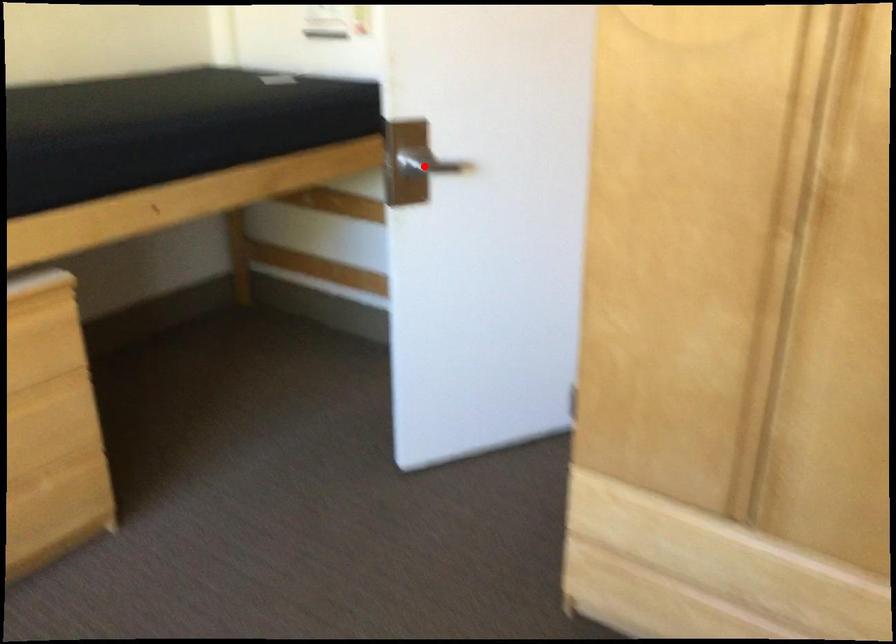
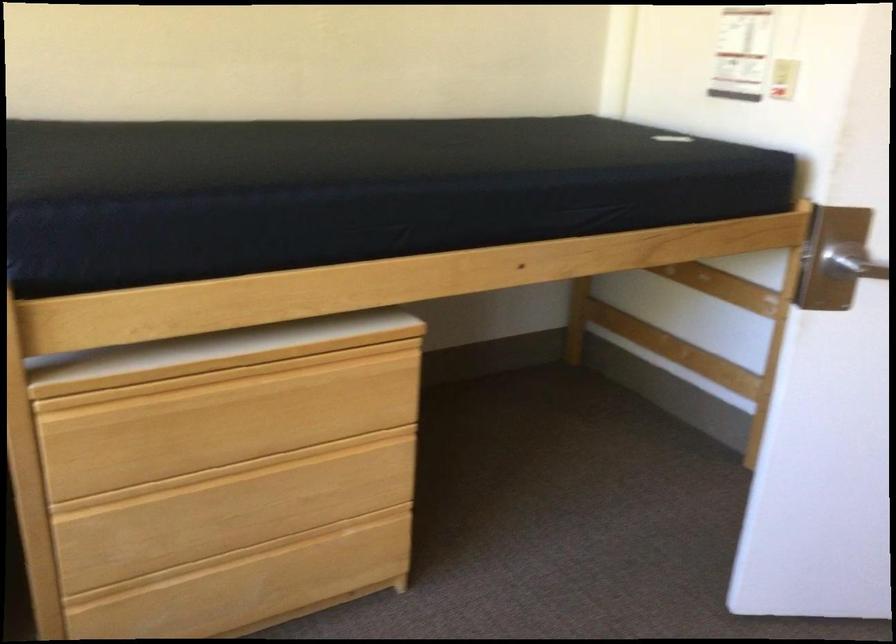
Where in the second image is the point corresponding to the highlighted location from the first image?

(851, 261)